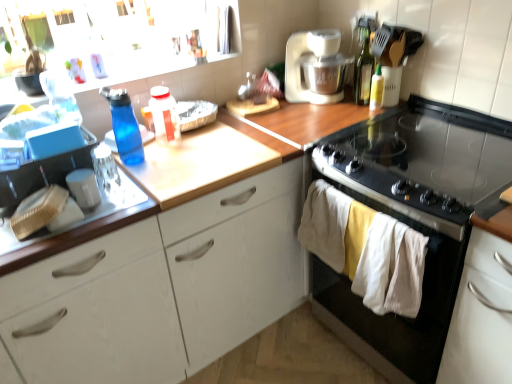
Where is `vacant point above wooden at upper center (from a real-world perspective)`? The height and width of the screenshot is (384, 512). vacant point above wooden at upper center (from a real-world perspective) is located at coordinates (179, 150).